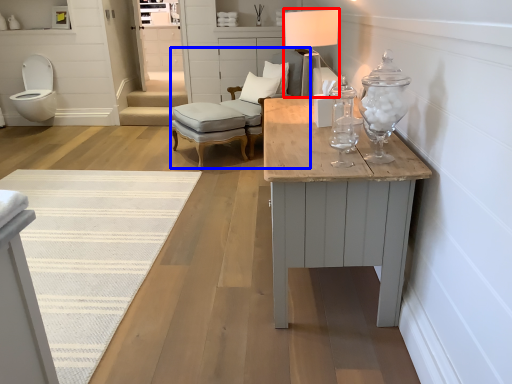
Question: Which of the following is the farthest to the observer, table lamp (highlighted by a red box) or armchair (highlighted by a blue box)?

Choices:
 (A) table lamp
 (B) armchair

Answer: (B)